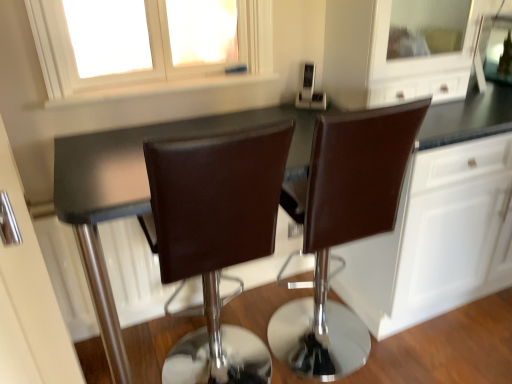
Question: Considering the relative positions of brown leather chair at center, which is counted as the first chair, starting from the right, and satin silver toaster at upper center in the image provided, is brown leather chair at center, which is counted as the first chair, starting from the right, to the left of satin silver toaster at upper center from the viewer's perspective?

Choices:
 (A) yes
 (B) no

Answer: (B)

Question: Is brown leather chair at center, which is counted as the first chair, starting from the right, looking in the opposite direction of satin silver toaster at upper center?

Choices:
 (A) no
 (B) yes

Answer: (A)

Question: Considering the relative sizes of brown leather chair at center, which is counted as the first chair, starting from the right, and satin silver toaster at upper center in the image provided, is brown leather chair at center, which is counted as the first chair, starting from the right, smaller than satin silver toaster at upper center?

Choices:
 (A) yes
 (B) no

Answer: (B)

Question: Is brown leather chair at center, which is counted as the first chair, starting from the right, with satin silver toaster at upper center?

Choices:
 (A) yes
 (B) no

Answer: (B)

Question: From a real-world perspective, is brown leather chair at center, positioned as the 2th chair in left-to-right order, on top of satin silver toaster at upper center?

Choices:
 (A) yes
 (B) no

Answer: (B)

Question: Which is correct: brown leather chair at center, which is counted as the first chair, starting from the right, is inside satin silver toaster at upper center, or outside of it?

Choices:
 (A) inside
 (B) outside

Answer: (B)

Question: Considering their positions, is brown leather chair at center, positioned as the 2th chair in left-to-right order, located in front of or behind satin silver toaster at upper center?

Choices:
 (A) front
 (B) behind

Answer: (A)

Question: From their relative heights in the image, would you say brown leather chair at center, which is counted as the first chair, starting from the right, is taller or shorter than satin silver toaster at upper center?

Choices:
 (A) short
 (B) tall

Answer: (B)

Question: In terms of size, does brown leather chair at center, positioned as the 2th chair in left-to-right order, appear bigger or smaller than satin silver toaster at upper center?

Choices:
 (A) big
 (B) small

Answer: (A)

Question: From a real-world perspective, is satin silver toaster at upper center physically located above or below brown leather chair at center, which is counted as the first chair, starting from the right?

Choices:
 (A) below
 (B) above

Answer: (B)

Question: In terms of height, does satin silver toaster at upper center look taller or shorter compared to brown leather chair at center, positioned as the 2th chair in left-to-right order?

Choices:
 (A) short
 (B) tall

Answer: (A)

Question: Considering the positions of satin silver toaster at upper center and brown leather chair at center, which is counted as the first chair, starting from the right, in the image, is satin silver toaster at upper center wider or thinner than brown leather chair at center, which is counted as the first chair, starting from the right,?

Choices:
 (A) wide
 (B) thin

Answer: (B)

Question: Is satin silver toaster at upper center in front of or behind brown leather chair at center, positioned as the 2th chair in left-to-right order, in the image?

Choices:
 (A) front
 (B) behind

Answer: (B)

Question: Which is correct: white matte window at upper center is inside brown leather chair at center, positioned as the 2th chair in right-to-left order, or outside of it?

Choices:
 (A) outside
 (B) inside

Answer: (A)

Question: Is white matte window at upper center to the left or to the right of brown leather chair at center, positioned as the 2th chair in right-to-left order, in the image?

Choices:
 (A) left
 (B) right

Answer: (A)